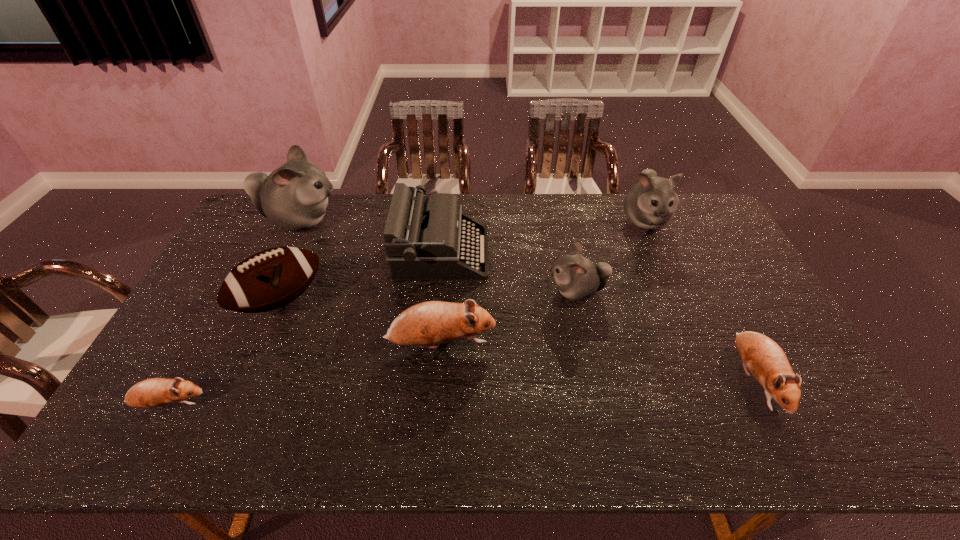
This screenshot has height=540, width=960. In order to click on blank space at the far edge of the desktop in this screenshot , I will do `click(333, 230)`.

I want to click on free space at the near edge, so click(491, 427).

This screenshot has height=540, width=960. In the image, there is a desktop. What are the coordinates of `vacant region at the left edge` in the screenshot? It's located at (169, 346).

In order to click on free location at the right edge of the desktop in this screenshot , I will do `click(741, 330)`.

In the image, there is a desktop. Where is `free region at the far right corner`? The width and height of the screenshot is (960, 540). free region at the far right corner is located at coordinates (708, 232).

Where is `vacant area that lies between the biggest brown hamster and the second biggest white hamster`? vacant area that lies between the biggest brown hamster and the second biggest white hamster is located at coordinates (542, 282).

The height and width of the screenshot is (540, 960). I want to click on unoccupied area between the football (American) and the second shortest hamster, so [x=517, y=340].

The image size is (960, 540). In order to click on free space that is in between the second white hamster from left to right and the football (American) in this screenshot , I will do `click(428, 296)`.

Locate an element on the screen. Image resolution: width=960 pixels, height=540 pixels. empty space that is in between the third hamster from left to right and the biggest white hamster is located at coordinates (371, 283).

At what (x,y) coordinates should I click in order to perform the action: click on vacant area that lies between the second brown hamster from right to left and the typewriter. Please return your answer as a coordinate pair (x, y). This screenshot has width=960, height=540. Looking at the image, I should click on (442, 298).